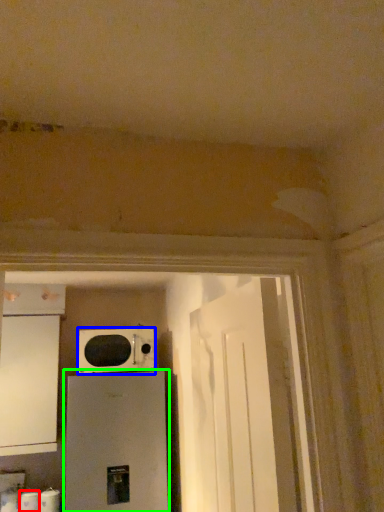
Question: Which object is the farthest from toilet paper (highlighted by a red box)? Choose among these: microwave oven (highlighted by a blue box) or home appliance (highlighted by a green box).

Choices:
 (A) microwave oven
 (B) home appliance

Answer: (A)